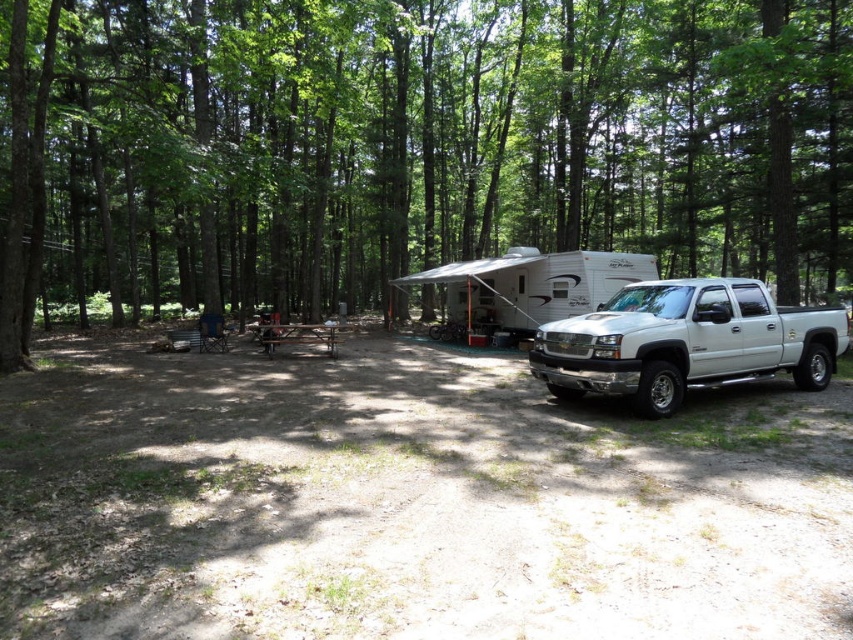
Who is positioned more to the right, white metallic pickup truck at right or brown wooden picnic table at center?

Positioned to the right is white metallic pickup truck at right.

In the scene shown: Does white metallic pickup truck at right have a smaller size compared to brown wooden picnic table at center?

Yes, white metallic pickup truck at right is smaller than brown wooden picnic table at center.

Identify the location of white metallic pickup truck at right. (685, 342).

The width and height of the screenshot is (853, 640). I want to click on white metallic pickup truck at right, so coord(685,342).

Which is below, green leafy tree at center or brown wooden picnic table at center?

brown wooden picnic table at center is lower down.

Who is positioned more to the right, green leafy tree at center or brown wooden picnic table at center?

green leafy tree at center

Where is `green leafy tree at center`? green leafy tree at center is located at coordinates (409, 148).

At what (x,y) coordinates should I click in order to perform the action: click on green leafy tree at center. Please return your answer as a coordinate pair (x, y). The width and height of the screenshot is (853, 640). Looking at the image, I should click on (409, 148).

Which is more to the right, green leafy tree at center or white metallic pickup truck at right?

white metallic pickup truck at right

Which is in front, point (432, 80) or point (695, 356)?

Point (695, 356) is more forward.

Find the location of `green leafy tree at center`. green leafy tree at center is located at coordinates (409, 148).